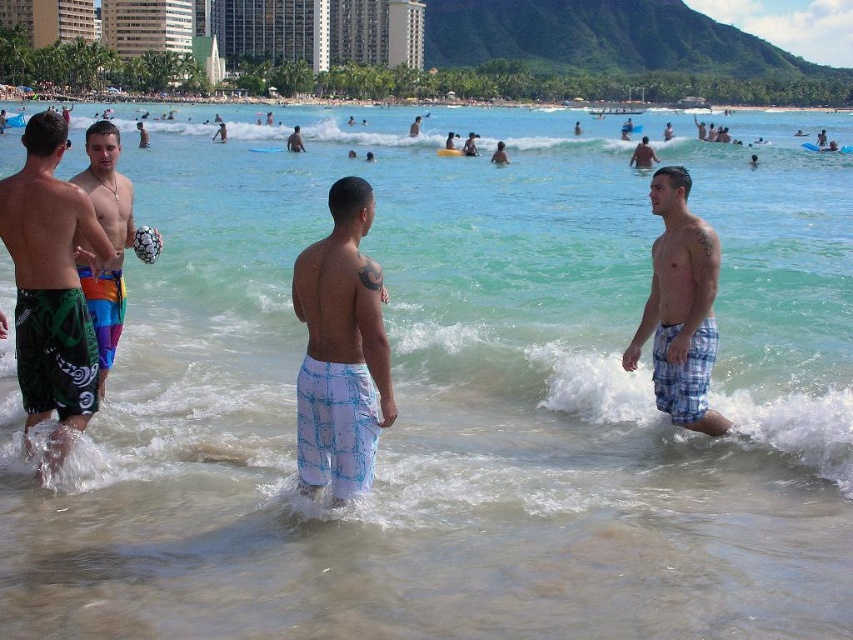
Question: Is green patterned shorts at left closer to the viewer compared to smooth skin body at center?

Choices:
 (A) no
 (B) yes

Answer: (B)

Question: Which point is closer to the camera?

Choices:
 (A) (347, 337)
 (B) (299, 141)

Answer: (A)

Question: Which point is closer to the camera?

Choices:
 (A) smooth skin body at center
 (B) plaid shorts at right
 (C) green patterned shorts at left

Answer: (C)

Question: Which point appears farthest from the camera in this image?

Choices:
 (A) (109, 132)
 (B) (657, 193)

Answer: (A)

Question: Is rainbow swim trunks at left further to camera compared to light blue plaid shorts at upper right?

Choices:
 (A) no
 (B) yes

Answer: (A)

Question: In this image, where is white plaid shorts at center located relative to plaid shorts at right?

Choices:
 (A) above
 (B) below

Answer: (A)